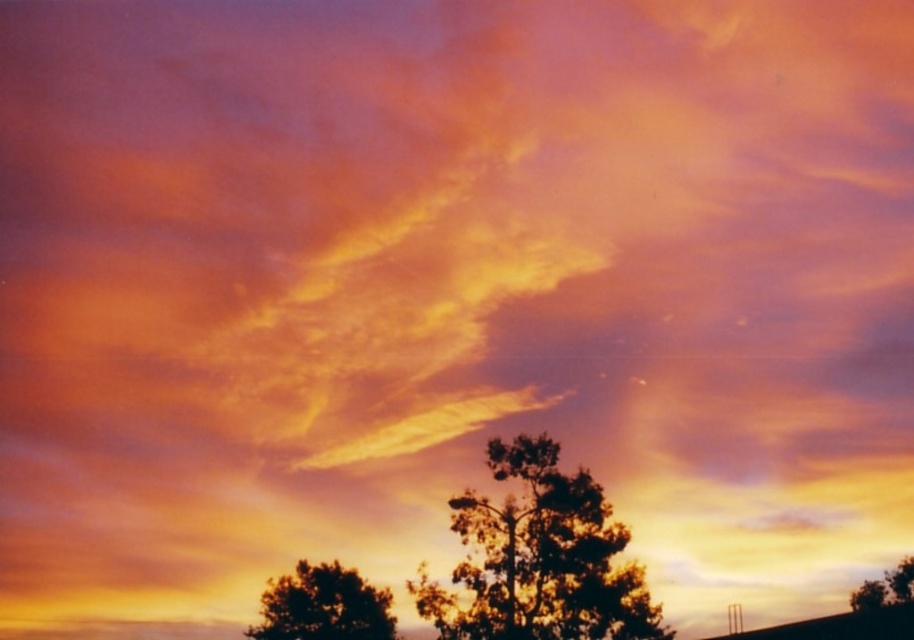
Who is lower down, silhouette leafy tree at center or silhouette leafy tree at lower center?

silhouette leafy tree at lower center is lower down.

At what (x,y) coordinates should I click in order to perform the action: click on silhouette leafy tree at center. Please return your answer as a coordinate pair (x, y). This screenshot has height=640, width=914. Looking at the image, I should click on (539, 557).

Is silhouette leafy tree at center wider than silhouette leafy tree at lower right?

Indeed, silhouette leafy tree at center has a greater width compared to silhouette leafy tree at lower right.

Is silhouette leafy tree at center bigger than silhouette leafy tree at lower right?

No.

Locate an element on the screen. silhouette leafy tree at center is located at coordinates (539, 557).

Locate an element on the screen. silhouette leafy tree at lower center is located at coordinates (323, 605).

Is silhouette leafy tree at lower center positioned before silhouette leafy tree at lower right?

Yes, silhouette leafy tree at lower center is in front of silhouette leafy tree at lower right.

Is point (343, 570) less distant than point (878, 582)?

That is True.

The width and height of the screenshot is (914, 640). I want to click on silhouette leafy tree at lower center, so click(323, 605).